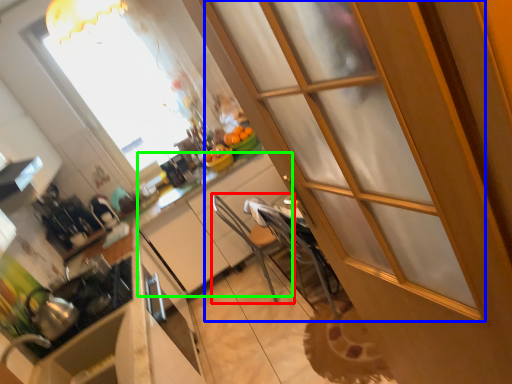
Question: Estimate the real-world distances between objects in this image. Which object is closer to armchair (highlighted by a red box), screen door (highlighted by a blue box) or cabinetry (highlighted by a green box)?

Choices:
 (A) screen door
 (B) cabinetry

Answer: (B)